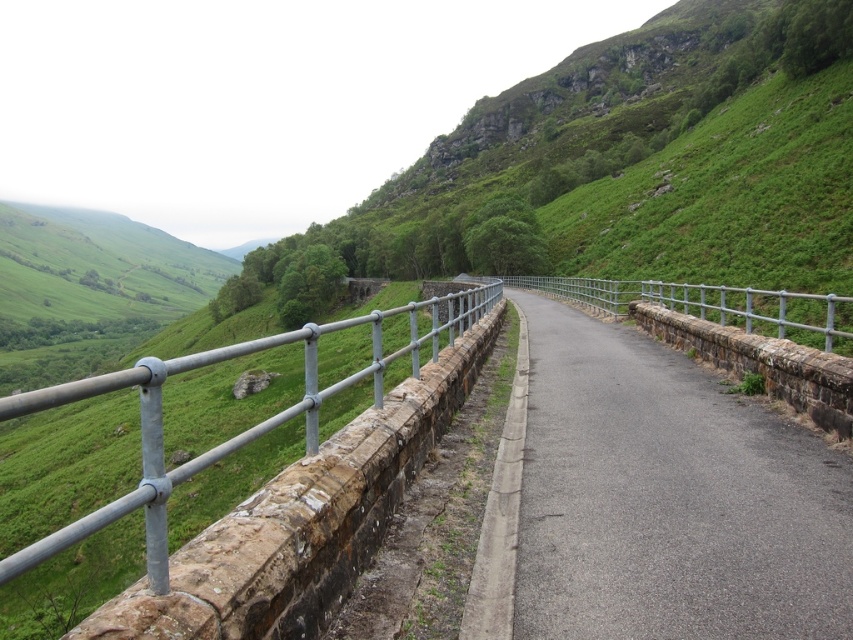
Question: Is asphalt road at center to the right of metallic gray railing at left from the viewer's perspective?

Choices:
 (A) no
 (B) yes

Answer: (B)

Question: Does metallic gray railing at left appear under silver metallic fence at center?

Choices:
 (A) no
 (B) yes

Answer: (B)

Question: Which of the following is the farthest from the observer?

Choices:
 (A) silver metallic fence at center
 (B) asphalt road at center

Answer: (A)

Question: Can you confirm if asphalt road at center is thinner than metallic gray railing at left?

Choices:
 (A) no
 (B) yes

Answer: (B)

Question: Which point is farther from the camera taking this photo?

Choices:
 (A) (534, 392)
 (B) (664, 305)
 (C) (271, 486)

Answer: (B)

Question: Which object appears farthest from the camera in this image?

Choices:
 (A) silver metallic fence at center
 (B) asphalt road at center
 (C) metallic gray railing at left

Answer: (A)